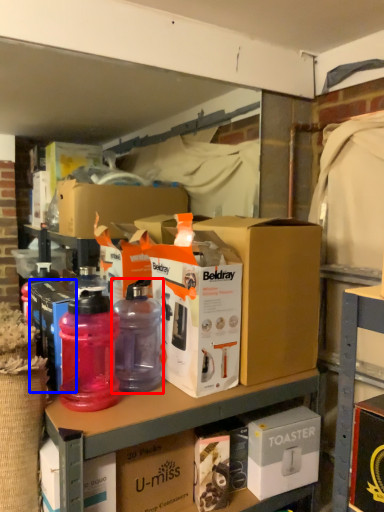
Question: Which of the following is the closest to the observer, bottle (highlighted by a red box) or box (highlighted by a blue box)?

Choices:
 (A) bottle
 (B) box

Answer: (A)